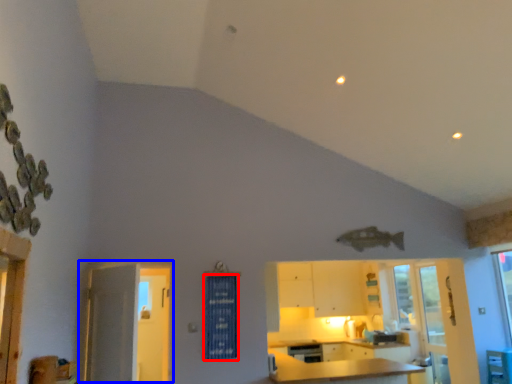
Question: Among these objects, which one is farthest to the camera, curtain (highlighted by a red box) or door (highlighted by a blue box)?

Choices:
 (A) curtain
 (B) door

Answer: (A)